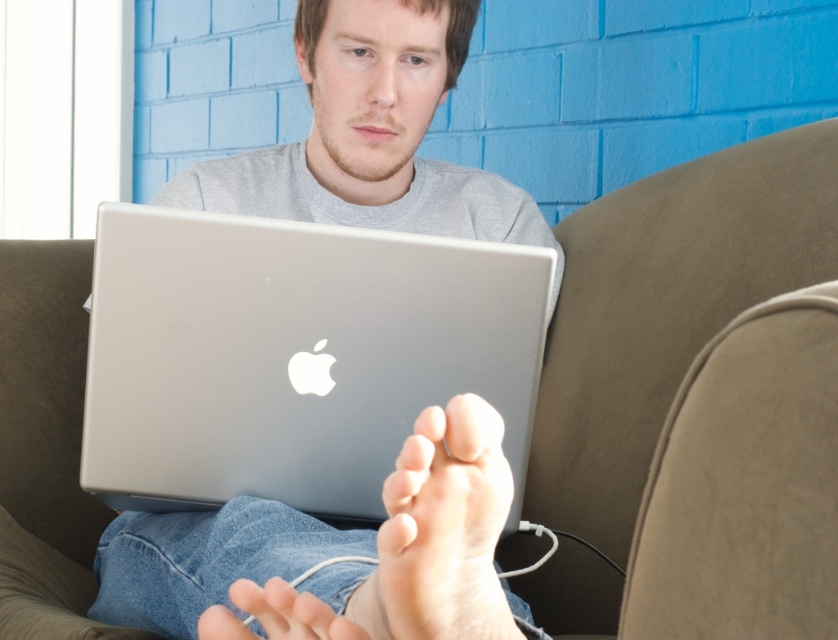
Question: Which object is closer to the camera taking this photo?

Choices:
 (A) silver metallic laptop at center
 (B) pale skin foot at lower center

Answer: (B)

Question: Does silver metallic laptop at center appear over pale skin foot at lower center?

Choices:
 (A) no
 (B) yes

Answer: (B)

Question: Is silver metallic laptop at center positioned at the back of pale skin foot at lower center?

Choices:
 (A) no
 (B) yes

Answer: (B)

Question: Can you confirm if silver metallic laptop at center is wider than pale skin foot at lower center?

Choices:
 (A) yes
 (B) no

Answer: (A)